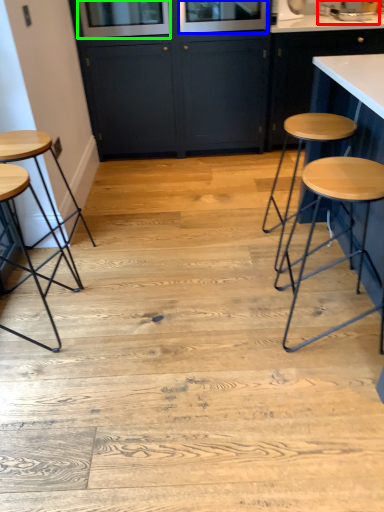
Question: Which object is the farthest from sink (highlighted by a red box)? Choose among these: window screen (highlighted by a blue box) or window screen (highlighted by a green box).

Choices:
 (A) window screen
 (B) window screen

Answer: (B)